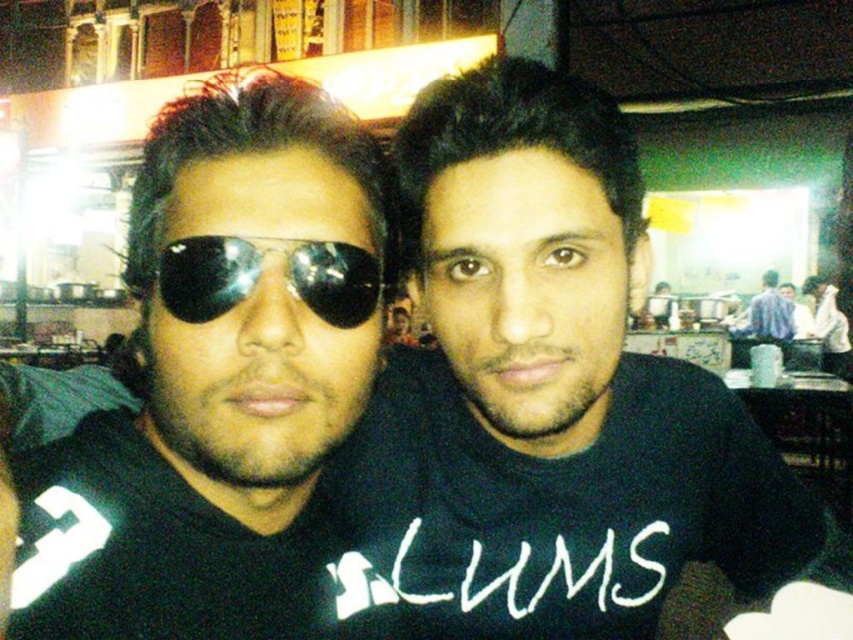
You are taking a photo of two people standing at point [169,305] and point [780,301]. Which point is closer to the camera?

Point [169,305] is closer to the camera than point [780,301].